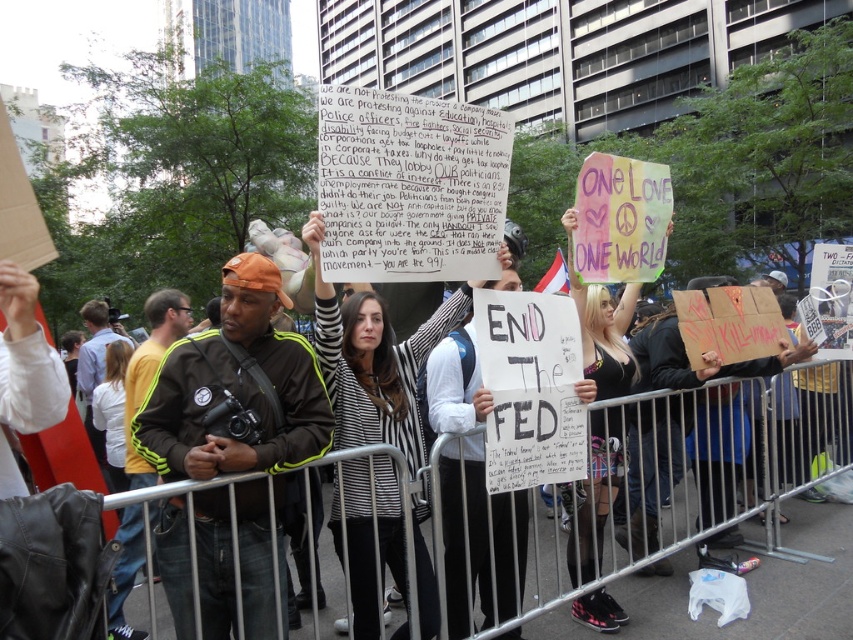
You are a photographer trying to capture a clear shot of both the green adidas jacket at center and the striped sweater at center. Since they are both in the center, can you adjust your position so that both are visible in the frame without one blocking the other?

The green adidas jacket at center is in front of the striped sweater at center, so you would need to position yourself so that you can see around or above the green adidas jacket at center to include the striped sweater at center in the frame.

You are a photographer trying to capture the protest scene. You notice two points in the image at coordinates point (167, 557) and point (396, 499). Which point is closer to your camera?

Point (167, 557) is closer to the camera than point (396, 499).

What is the relationship in size between the green adidas jacket at center and the striped sweater at center in the protest scene?

The green adidas jacket at center is smaller than the striped sweater at center.